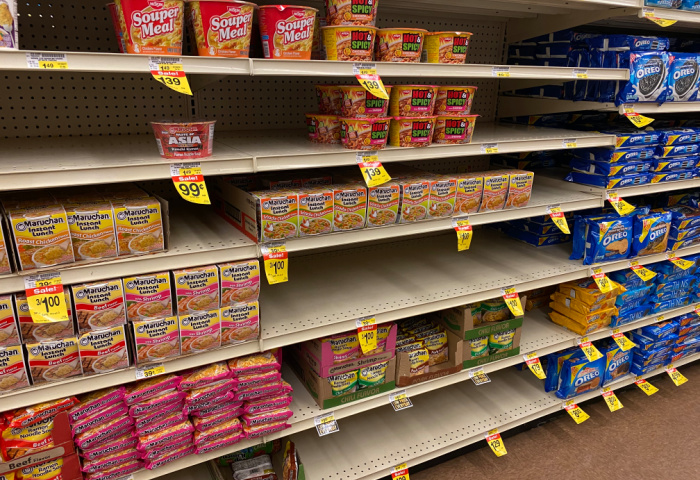
The image size is (700, 480). What are the coordinates of `shelves in store` in the screenshot? It's located at (463, 71), (461, 150), (430, 224), (396, 315), (430, 388), (421, 461), (678, 16).